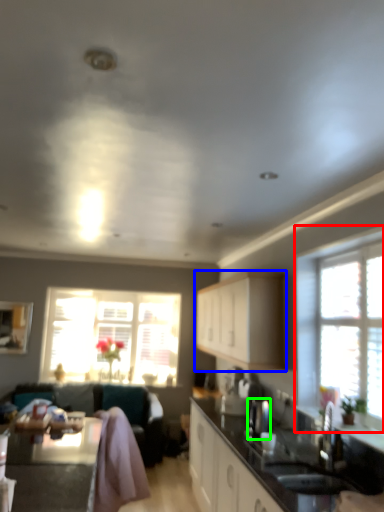
Question: Which is farther away from window (highlighted by a red box)? cabinetry (highlighted by a blue box) or appliance (highlighted by a green box)?

Choices:
 (A) cabinetry
 (B) appliance

Answer: (A)